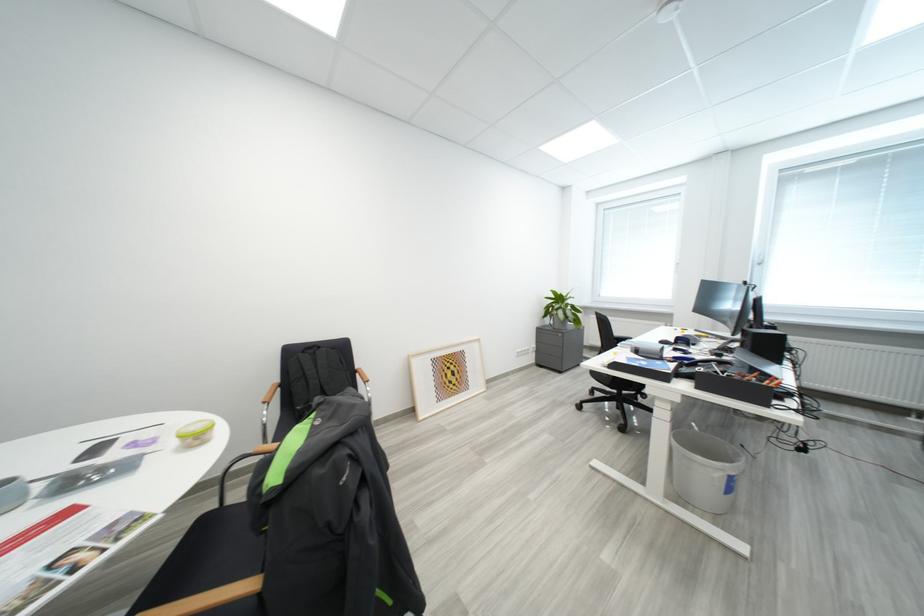
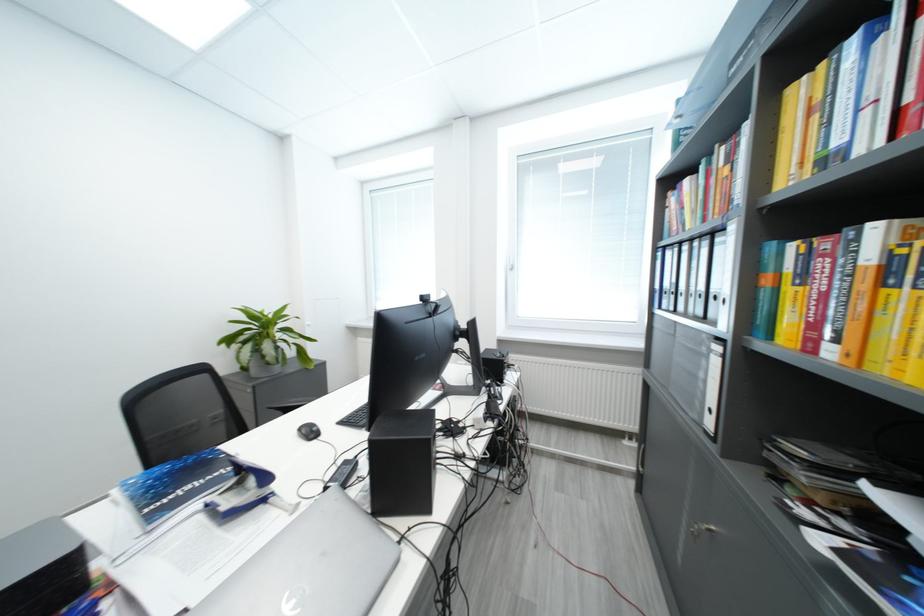
In the second image, find the point that corresponds to (x=565, y=310) in the first image.

(251, 341)